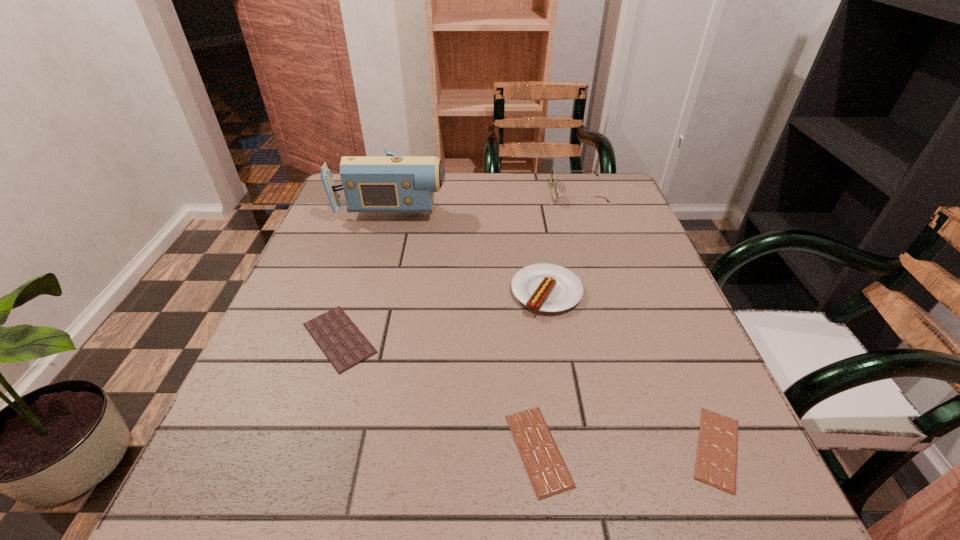
At what (x,y) coordinates should I click in order to perform the action: click on free spot between the third tallest object and the second chocolate bar from right to left. Please return your answer as a coordinate pair (x, y). The width and height of the screenshot is (960, 540). Looking at the image, I should click on (542, 371).

Where is `vacant space that's between the farthest chocolate bar and the rightmost chocolate bar`? vacant space that's between the farthest chocolate bar and the rightmost chocolate bar is located at coordinates pyautogui.click(x=528, y=393).

Where is `free spot between the tallest object and the second chocolate bar from left to right`? The image size is (960, 540). free spot between the tallest object and the second chocolate bar from left to right is located at coordinates (467, 326).

The height and width of the screenshot is (540, 960). Identify the location of free point between the sunglasses and the camcorder. (487, 197).

Image resolution: width=960 pixels, height=540 pixels. Find the location of `free space between the leftmost chocolate bar and the sunglasses`. free space between the leftmost chocolate bar and the sunglasses is located at coordinates (459, 266).

Find the location of a particular element. The image size is (960, 540). free space between the rightmost chocolate bar and the sunglasses is located at coordinates (648, 321).

Where is `vacant space in between the sausage and the rightmost chocolate bar`? This screenshot has width=960, height=540. vacant space in between the sausage and the rightmost chocolate bar is located at coordinates (632, 370).

Find the location of a particular element. This screenshot has height=540, width=960. free space between the third tallest object and the second chocolate bar from right to left is located at coordinates (542, 371).

Where is `vacant space that is in between the rightmost chocolate bar and the sunglasses`? The width and height of the screenshot is (960, 540). vacant space that is in between the rightmost chocolate bar and the sunglasses is located at coordinates (648, 321).

Identify the location of vacant space that is in between the third tallest object and the tallest object. (471, 246).